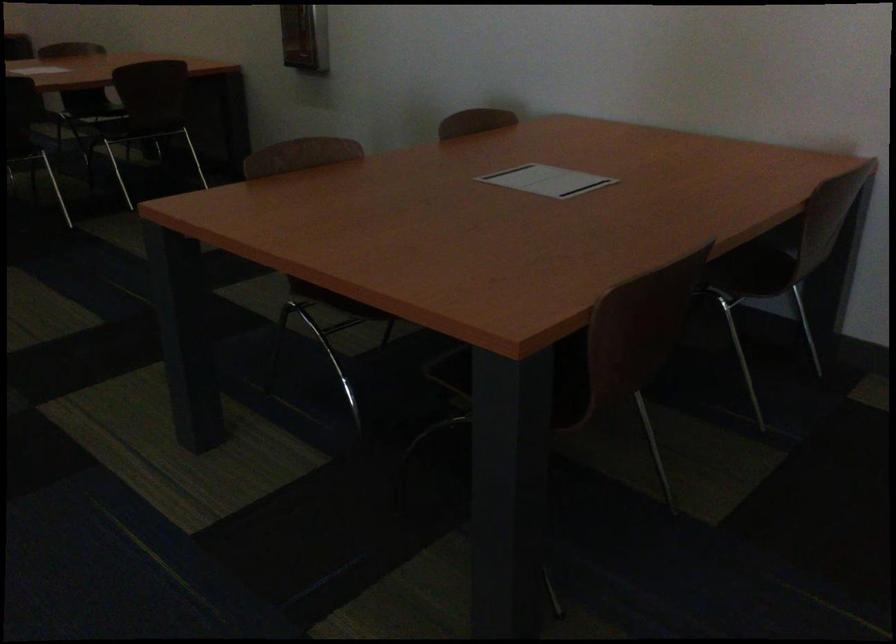
Looking at this image, how did the camera likely rotate?

The camera's rotation is toward left-down.